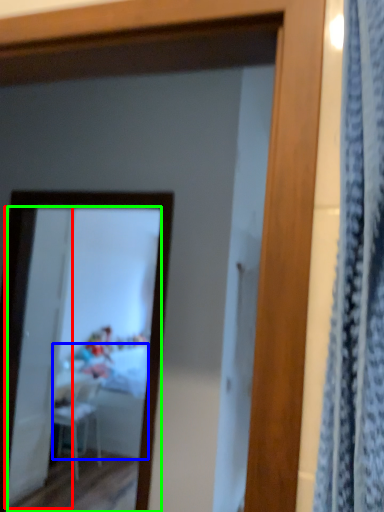
Question: Which object is positioned farthest from screen door (highlighted by a red box)? Select from table (highlighted by a blue box) and mirror (highlighted by a green box).

Choices:
 (A) table
 (B) mirror

Answer: (A)